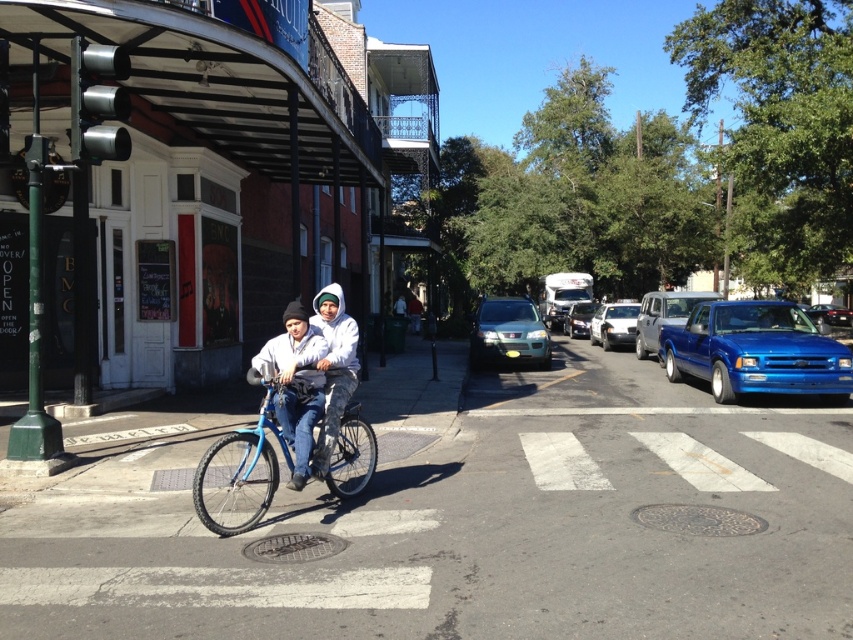
You are a delivery driver needing to park your vehicle in this area. The satin silver suv at center and the shiny blue truck at right are already parked. Which vehicle would require less space to park beside?

The satin silver suv at center has a smaller size compared to the shiny blue truck at right, so it would require less space to park beside the satin silver suv at center.

You are a delivery person needing to park your vehicle in a narrow alley that can only accommodate vehicles no taller than the shiny blue truck at right. Based on the scene, can the satin silver suv at center fit into the alley?

The satin silver suv at center is much taller than the shiny blue truck at right, so it cannot fit into the alley designed for vehicles no taller than the shiny blue truck at right.

You are a delivery person trying to deliver a package to a recipient wearing a white fleece jacket at center. The shiny blue truck at right is blocking the path. Can you estimate if the truck is wider than the jacket?

The white fleece jacket at center has a lesser width compared to shiny blue truck at right, so yes, the truck is wider than the jacket.